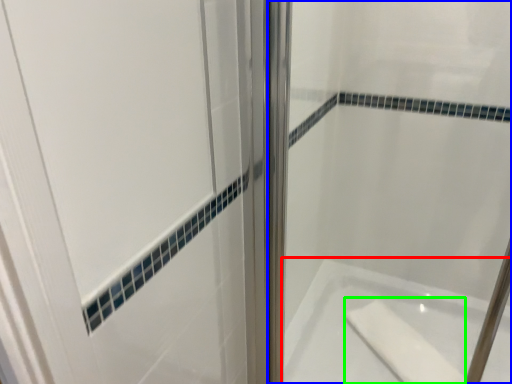
Question: Which object is positioned farthest from bathtub (highlighted by a red box)? Select from shower door (highlighted by a blue box) and soap (highlighted by a green box).

Choices:
 (A) shower door
 (B) soap

Answer: (A)